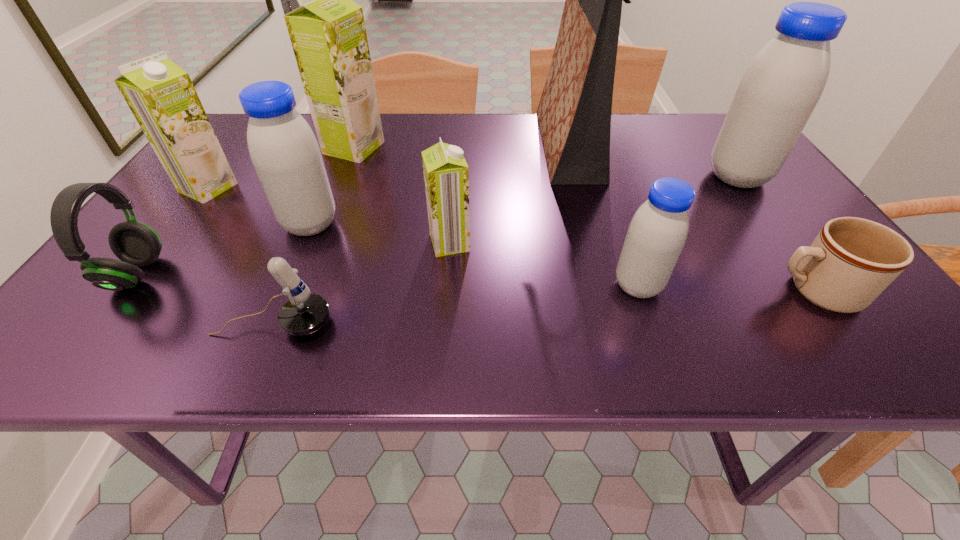
Image resolution: width=960 pixels, height=540 pixels. I want to click on the nearest green soya milk, so click(446, 174).

Locate an element on the screen. This screenshot has height=540, width=960. the second blue soya milk from left to right is located at coordinates (656, 235).

Identify the location of the smallest blue soya milk. Image resolution: width=960 pixels, height=540 pixels. (656, 235).

Image resolution: width=960 pixels, height=540 pixels. Find the location of `headset`. headset is located at coordinates (136, 244).

Where is `white microphone`? This screenshot has height=540, width=960. white microphone is located at coordinates (304, 313).

The width and height of the screenshot is (960, 540). Identify the location of the ninth tallest object. (304, 313).

Where is `the shortest object`? the shortest object is located at coordinates (852, 260).

This screenshot has width=960, height=540. Identify the location of mug. (852, 260).

Find the location of `vacant region located on the front-facing side of the tallest object`. vacant region located on the front-facing side of the tallest object is located at coordinates 403,145.

In order to click on vacant space located on the front-facing side of the tallest object in this screenshot , I will do `click(505, 145)`.